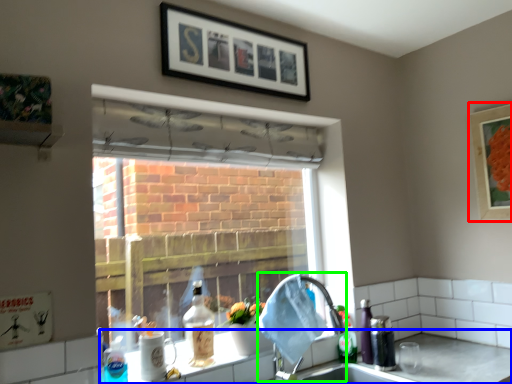
Question: Based on their relative distances, which object is nearer to picture frame (highlighted by a red box)? Choose from counter top (highlighted by a blue box) and faucet (highlighted by a green box).

Choices:
 (A) counter top
 (B) faucet

Answer: (A)